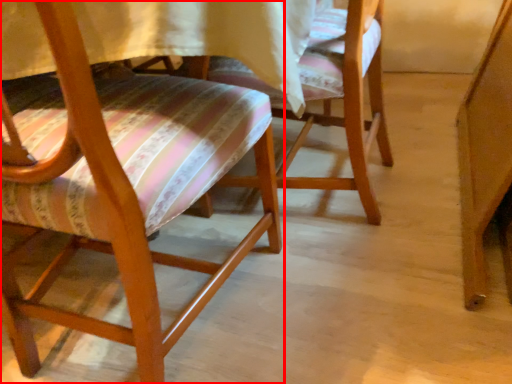
Question: From the image's perspective, where is chair (annotated by the red box) located relative to chair?

Choices:
 (A) above
 (B) below

Answer: (B)